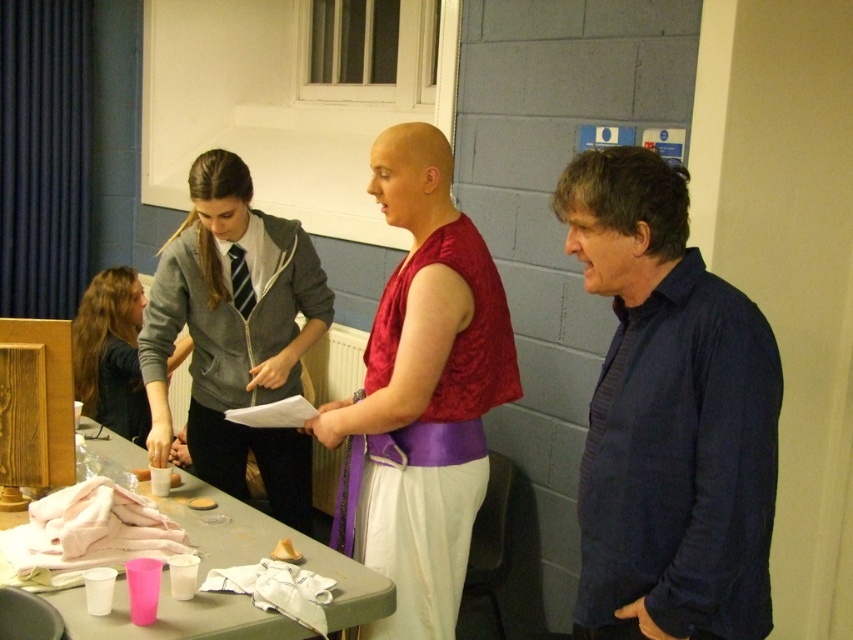
What is the color of the object located at the coordinates point (421, 394) in the image?

The object at point (421, 394) is a shiny red fabric top at center.

You are trying to decide which clothing item to wear for a casual day out. You have a shiny red fabric top at center and a matte gray hoodie at center. According to the scene, which clothing item is more visible from above?

The shiny red fabric top at center is positioned under the matte gray hoodie at center, so the matte gray hoodie at center is more visible from above.

You are organizing a small event and need to place a new item between the pink plastic cups at lower left and the matte gray hoodie at center. Based on their positions, where should you position the new item relative to the hoodie?

The pink plastic cups at lower left are to the right of the matte gray hoodie at center. Therefore, to place the new item between them, it should be positioned to the left of the matte gray hoodie at center.